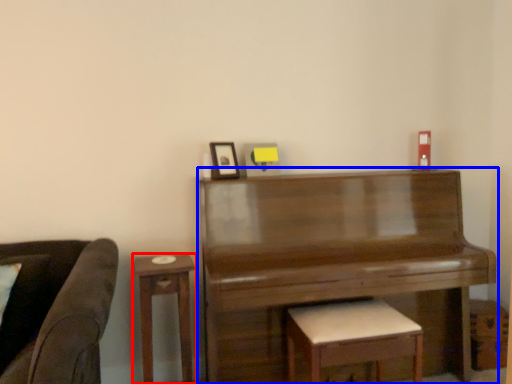
Question: Which object is further to the camera taking this photo, table (highlighted by a red box) or piano (highlighted by a blue box)?

Choices:
 (A) table
 (B) piano

Answer: (A)